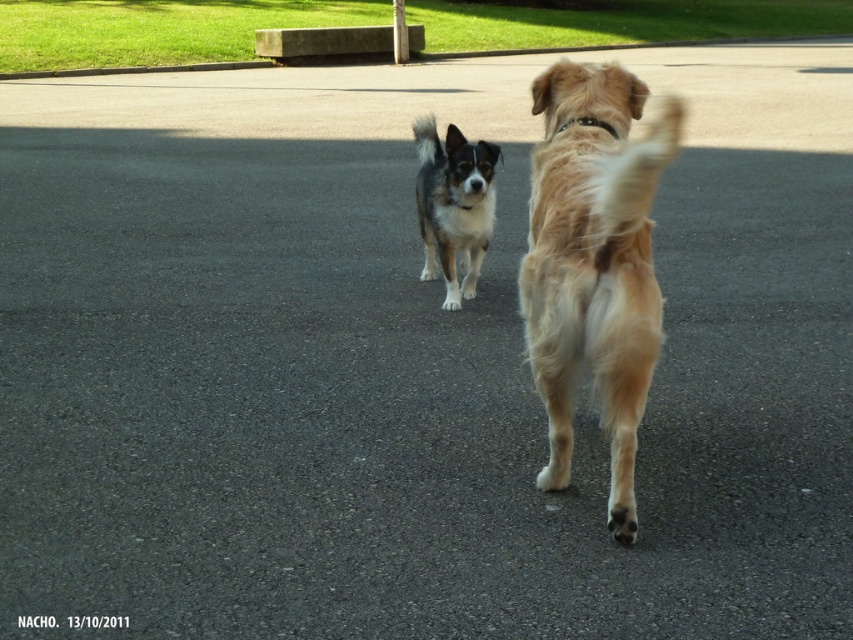
Is point (550, 332) positioned before point (485, 234)?

Yes, it is.

Does point (527, 262) come behind point (492, 221)?

That is False.

Find the location of a particular element. The width and height of the screenshot is (853, 640). golden fur dog at center is located at coordinates (593, 262).